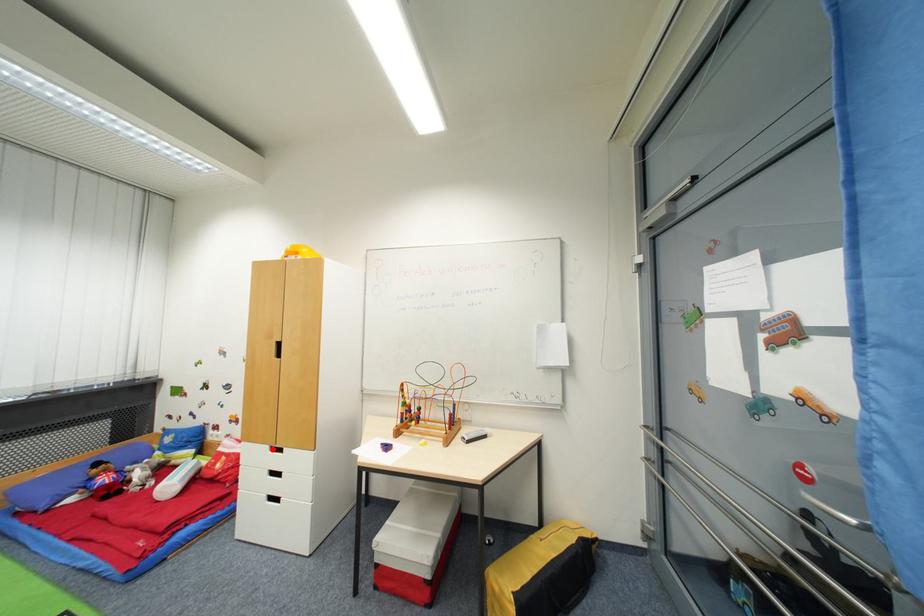
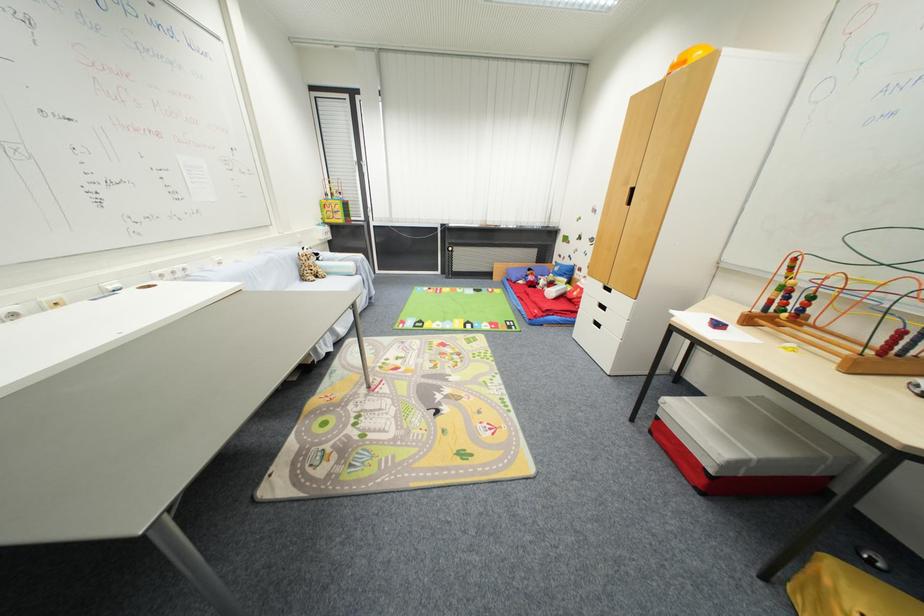
The point at the highlighted location is marked in the first image. Where is the corresponding point in the second image?

(606, 286)